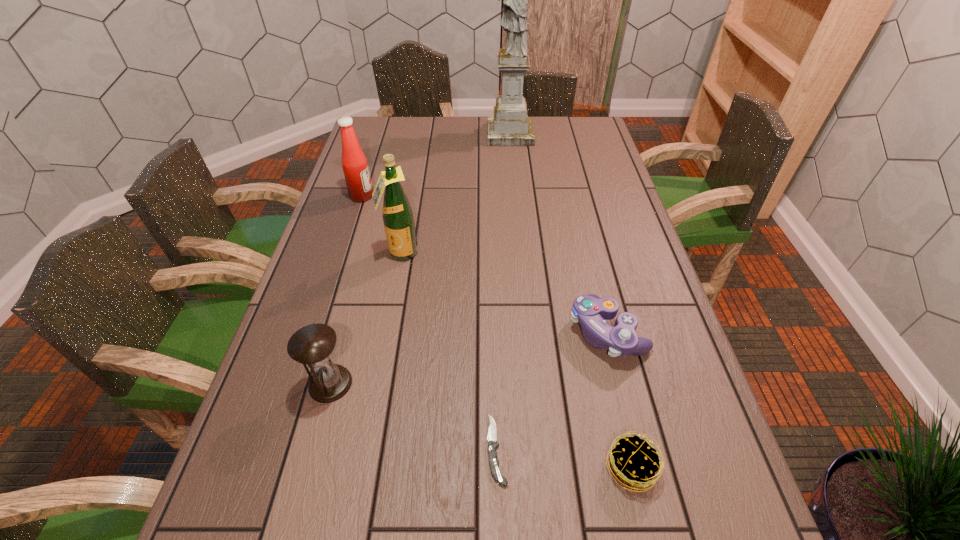
This screenshot has width=960, height=540. In order to click on free space that satisfies the following two spatial constraints: 1. on the front-facing side of the fifth shortest object; 2. on the back side of the hourglass in this screenshot , I will do `click(303, 383)`.

You are a GUI agent. You are given a task and a screenshot of the screen. Output one action in this format:
    pyautogui.click(x=<x>, y=<y>)
    Task: Click on the vacant region that satisfies the following two spatial constraints: 1. on the front side of the shortest object; 2. on the right side of the hourglass
    The image size is (960, 540).
    Given the screenshot: What is the action you would take?
    pyautogui.click(x=313, y=449)

Where is `free space that satisfies the following two spatial constraints: 1. on the back side of the control; 2. on the front-facing side of the sculpture`? free space that satisfies the following two spatial constraints: 1. on the back side of the control; 2. on the front-facing side of the sculpture is located at coordinates (558, 134).

Where is `free region that satisfies the following two spatial constraints: 1. on the front-facing side of the patty; 2. on the right side of the fifth object from right to left`? The image size is (960, 540). free region that satisfies the following two spatial constraints: 1. on the front-facing side of the patty; 2. on the right side of the fifth object from right to left is located at coordinates (361, 467).

The width and height of the screenshot is (960, 540). Identify the location of vacant position in the image that satisfies the following two spatial constraints: 1. on the back side of the hourglass; 2. on the front-facing side of the sixth nearest object. (380, 196).

Image resolution: width=960 pixels, height=540 pixels. Find the location of `vacant position in the image that satisfies the following two spatial constraints: 1. on the front-facing side of the patty; 2. on the left side of the tallest object`. vacant position in the image that satisfies the following two spatial constraints: 1. on the front-facing side of the patty; 2. on the left side of the tallest object is located at coordinates (542, 467).